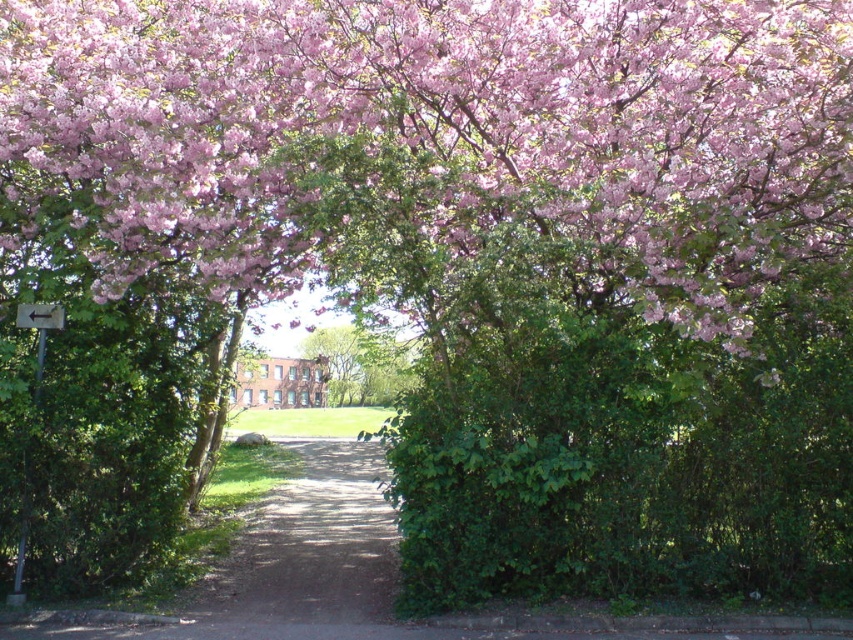
Question: Can you confirm if pink bloom at upper center is positioned below dirt path at center?

Choices:
 (A) yes
 (B) no

Answer: (B)

Question: Does pink bloom at upper center have a larger size compared to green leafy tree at center?

Choices:
 (A) no
 (B) yes

Answer: (B)

Question: Which object is closer to the camera taking this photo?

Choices:
 (A) dirt path at center
 (B) green leafy tree at center
 (C) pink bloom at upper center

Answer: (C)

Question: Does pink bloom at upper center appear on the left side of dirt path at center?

Choices:
 (A) yes
 (B) no

Answer: (B)

Question: Based on their relative distances, which object is nearer to the pink bloom at upper center?

Choices:
 (A) dirt path at center
 (B) green leafy tree at center

Answer: (A)

Question: Among these objects, which one is farthest from the camera?

Choices:
 (A) pink bloom at upper center
 (B) dirt path at center

Answer: (B)